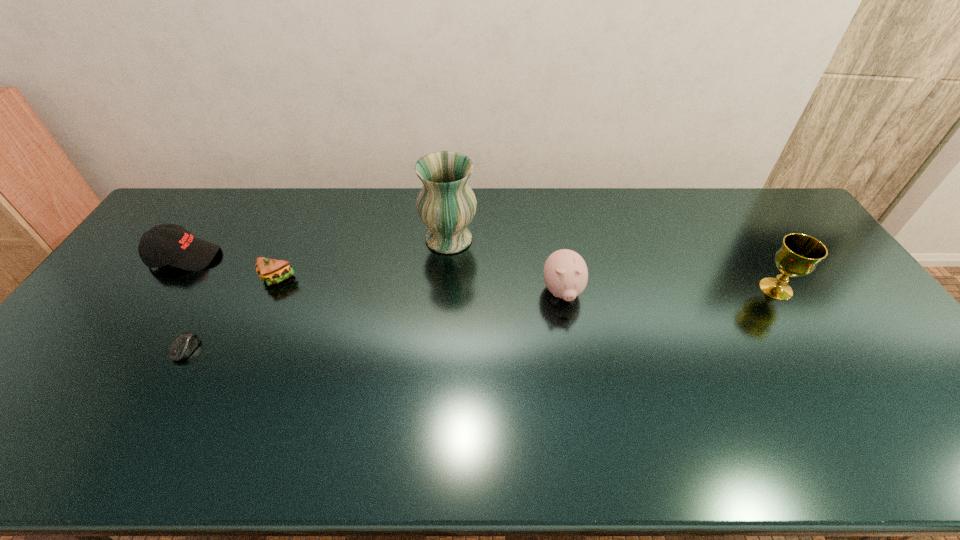
Where is `vase`? The height and width of the screenshot is (540, 960). vase is located at coordinates click(446, 204).

This screenshot has height=540, width=960. Find the location of `the third object from right to left`. the third object from right to left is located at coordinates (446, 204).

The width and height of the screenshot is (960, 540). What are the coordinates of `the second tallest object` in the screenshot? It's located at (799, 255).

What are the coordinates of `chalice` in the screenshot? It's located at (799, 255).

At what (x,y) coordinates should I click in order to perform the action: click on the second object from right to left. Please return your answer as a coordinate pair (x, y). Looking at the image, I should click on (565, 272).

At what (x,y) coordinates should I click in order to perform the action: click on the leftmost object. Please return your answer as a coordinate pair (x, y). The width and height of the screenshot is (960, 540). Looking at the image, I should click on (167, 244).

Where is `the third shortest object`? the third shortest object is located at coordinates (167, 244).

In order to click on sandwich in this screenshot , I will do `click(273, 271)`.

At what (x,y) coordinates should I click in order to perform the action: click on the second shortest object. Please return your answer as a coordinate pair (x, y). This screenshot has height=540, width=960. Looking at the image, I should click on (273, 271).

At what (x,y) coordinates should I click in order to perform the action: click on the second object from left to right. Please return your answer as a coordinate pair (x, y). The height and width of the screenshot is (540, 960). Looking at the image, I should click on (184, 345).